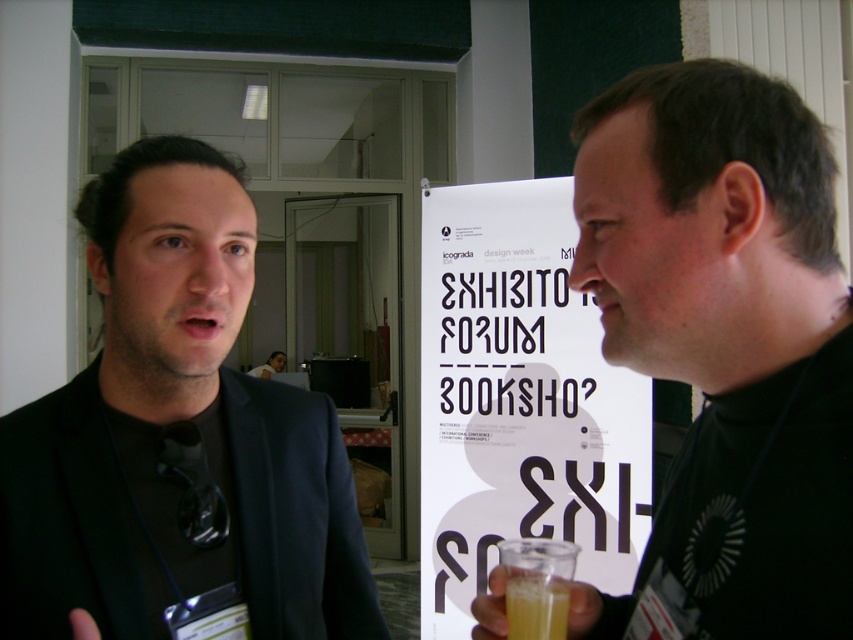
Question: Is the position of black turtleneck sweater at right more distant than that of translucent glass at lower center?

Choices:
 (A) no
 (B) yes

Answer: (A)

Question: Which of the following is the closest to the observer?

Choices:
 (A) light blue shirt at center
 (B) translucent glass at lower center
 (C) matte black suit at left

Answer: (C)

Question: Observing the image, what is the correct spatial positioning of black turtleneck sweater at right in reference to light blue shirt at center?

Choices:
 (A) above
 (B) below

Answer: (A)

Question: Among these objects, which one is nearest to the camera?

Choices:
 (A) light blue shirt at center
 (B) white paper poster at center
 (C) black turtleneck sweater at right
 (D) matte black suit at left

Answer: (C)

Question: Does white paper poster at center appear on the left side of light blue shirt at center?

Choices:
 (A) no
 (B) yes

Answer: (A)

Question: Which point is farther to the camera?

Choices:
 (A) (541, 580)
 (B) (279, 356)
 (C) (19, 509)

Answer: (B)